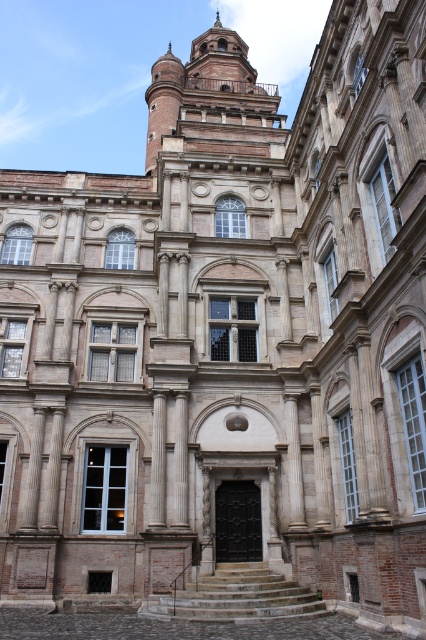
You are an architect examining the building. You notice the brown stone tower at upper center and the matte white clock at upper center. Which of these two objects is taller?

The brown stone tower at upper center is taller than the matte white clock at upper center according to the description.

You are an architect planning to install a new decorative element between the brown stone tower at upper center and the matte white clock at upper center. The element requires a minimum of 45 meters of space. Can the available space accommodate this requirement?

The distance between the brown stone tower at upper center and the matte white clock at upper center is 45.01 meters, which is just over the required 45 meters. Therefore, the space can accommodate the decorative element.